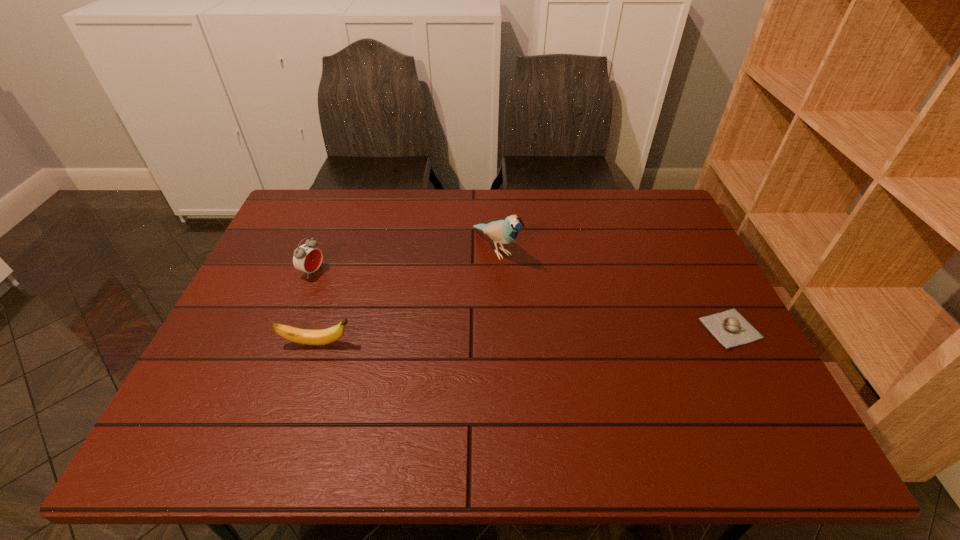
Locate an element on the screen. The height and width of the screenshot is (540, 960). the second shortest object is located at coordinates (302, 336).

Image resolution: width=960 pixels, height=540 pixels. What are the coordinates of `garlic` in the screenshot? It's located at (729, 327).

Locate an element on the screen. This screenshot has width=960, height=540. the rightmost object is located at coordinates (729, 327).

Image resolution: width=960 pixels, height=540 pixels. In order to click on the third shortest object in this screenshot , I will do tap(307, 258).

This screenshot has width=960, height=540. In order to click on bird in this screenshot , I will do `click(505, 231)`.

You are a GUI agent. You are given a task and a screenshot of the screen. Output one action in this format:
    pyautogui.click(x=<x>, y=<y>)
    Task: Click on the tallest object
    
    Given the screenshot: What is the action you would take?
    pyautogui.click(x=505, y=231)

This screenshot has width=960, height=540. I want to click on vacant space located at the stem of the second shortest object, so point(417,343).

Where is `vacant space located on the left of the shortest object`? This screenshot has height=540, width=960. vacant space located on the left of the shortest object is located at coordinates (540, 328).

This screenshot has height=540, width=960. Find the location of `free space located 0.240m on the face of the alarm clock`. free space located 0.240m on the face of the alarm clock is located at coordinates (392, 306).

At what (x,y) coordinates should I click in order to perform the action: click on free region located 0.270m on the face of the alarm clock. Please return your answer as a coordinate pair (x, y). Looking at the image, I should click on (401, 310).